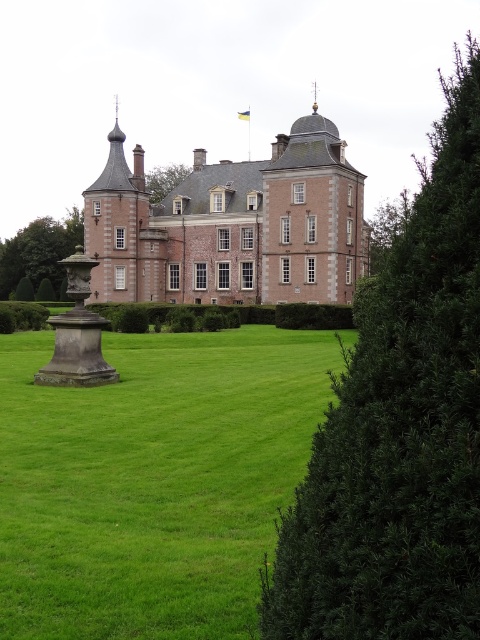
Question: Among these objects, which one is nearest to the camera?

Choices:
 (A) brick stone castle at center
 (B) green leafy tree at upper center
 (C) green leafy hedge at left
 (D) green leafy tree at left

Answer: (A)

Question: Is green leafy bush at right in front of green leafy tree at upper center?

Choices:
 (A) yes
 (B) no

Answer: (A)

Question: Can you confirm if green leafy bush at right is smaller than green leafy tree at left?

Choices:
 (A) no
 (B) yes

Answer: (A)

Question: Does green leafy bush at right appear over green leafy tree at upper center?

Choices:
 (A) yes
 (B) no

Answer: (B)

Question: Which is farther from the green leafy tree at left?

Choices:
 (A) brick stone castle at center
 (B) green leafy hedge at left
 (C) green leafy tree at upper center

Answer: (B)

Question: Which object is positioned closest to the brick stone castle at center?

Choices:
 (A) green grass at center
 (B) green leafy hedge at left
 (C) green leafy tree at left
 (D) green leafy bush at right

Answer: (B)